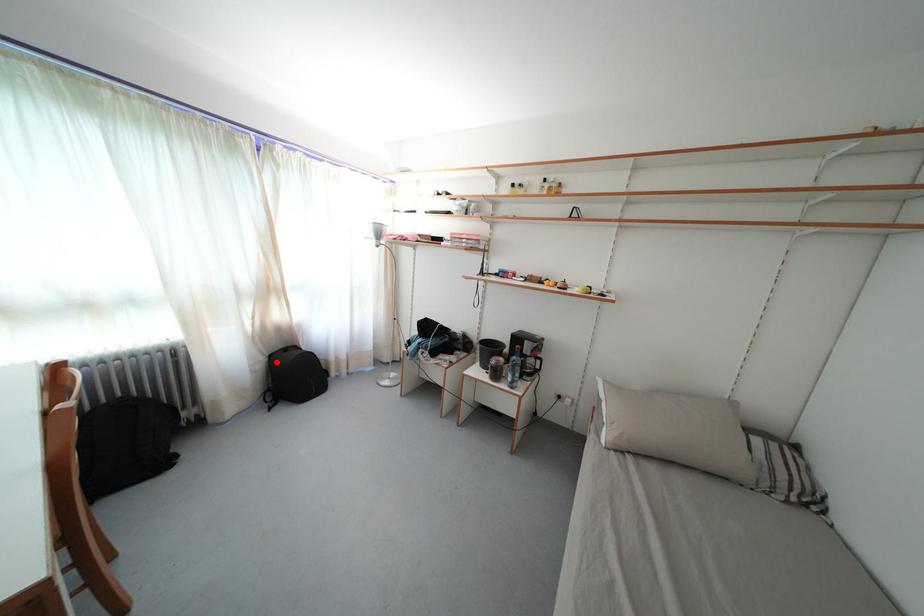
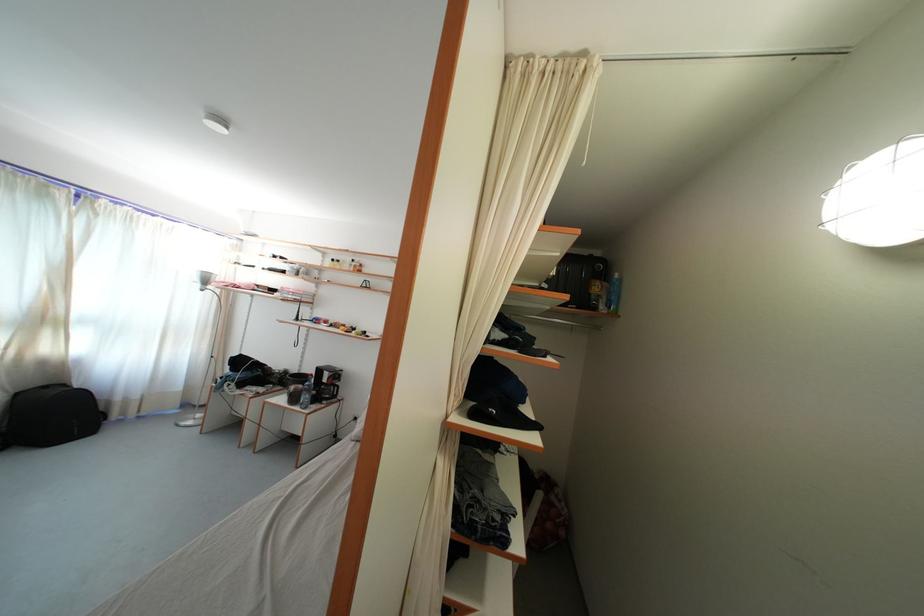
Locate, in the second image, the point that corresponds to the highlighted location in the first image.

(23, 400)